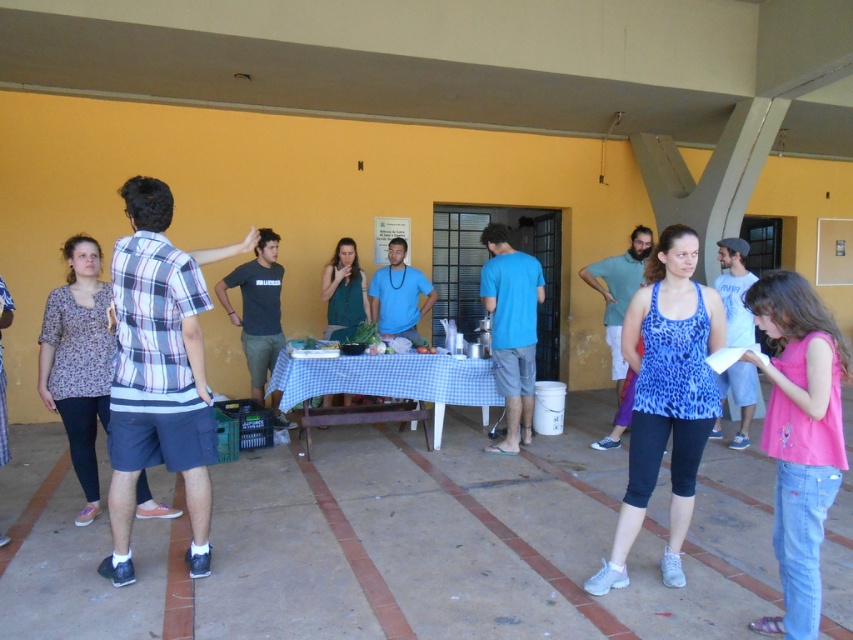
Question: Which of the following is the closest to the observer?

Choices:
 (A) dark gray t-shirt at center
 (B) pink cotton tank top at lower right
 (C) blue leopard print tank top at center
 (D) leopard print tank top at center

Answer: (B)

Question: Which of these objects is positioned closest to the leopard print tank top at center?

Choices:
 (A) dark gray t-shirt at center
 (B) blue cotton t-shirt at center
 (C) blue checkered tablecloth at center
 (D) blue leopard print tank top at center

Answer: (B)

Question: Is the position of pink cotton tank top at lower right more distant than that of dark gray t-shirt at center?

Choices:
 (A) yes
 (B) no

Answer: (B)

Question: Does dark gray t-shirt at center lie behind leopard print tank top at center?

Choices:
 (A) no
 (B) yes

Answer: (B)

Question: Among these points, which one is nearest to the camera?

Choices:
 (A) (281, 275)
 (B) (604, 316)
 (C) (671, 504)

Answer: (C)

Question: In this image, where is blue leopard print tank top at center located relative to pink cotton tank top at lower right?

Choices:
 (A) below
 (B) above

Answer: (B)